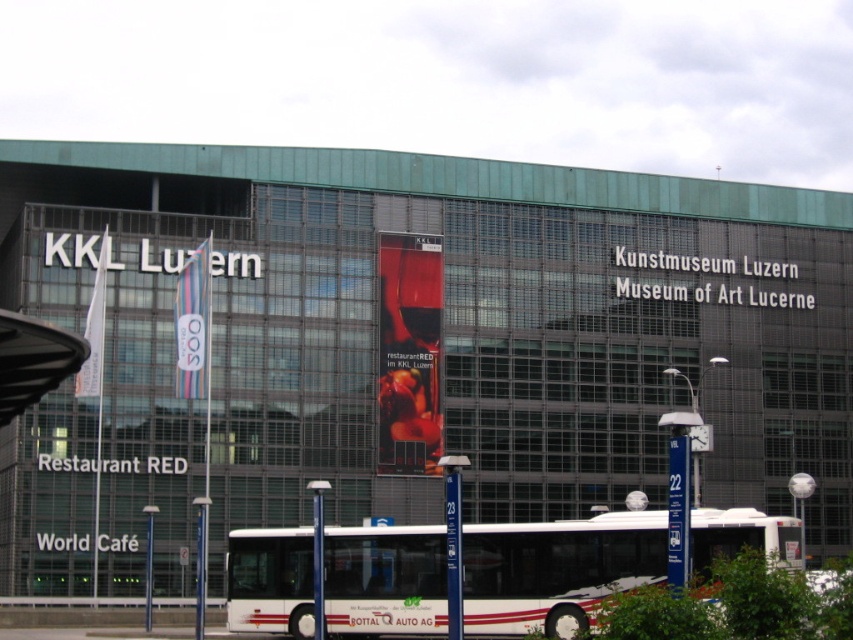
You are standing in front of the KKL Luzern building and notice two points marked on the facade. The first point is at coordinates point [537,616] and the second is at point [399,307]. Which of these points appears closer to you when looking at the building?

Point [537,616] is closer to the camera than point [399,307], so the first point appears closer to you.

You are standing in front of the KKL Luzern building and want to take a photo of the point at coordinates [560,580]. If your camera has a maximum focus range of 50 meters, will it be able to capture the point clearly?

The point at coordinates [560,580] is 45.96 meters away from the camera. Since the maximum focus range is 50 meters, the camera can focus on the point clearly.

Consider the image. You are standing at the entrance of the KKL Luzern building. You see a white metallic bus at center and a matte glass banner at center. If you want to take a photo that includes both objects in the frame, which one should you move closer to and which one should you move away from?

Since the white metallic bus at center is 17.82 meters away from the matte glass banner at center, you should move closer to the matte glass banner at center and move away from the white metallic bus at center to include both in the frame.